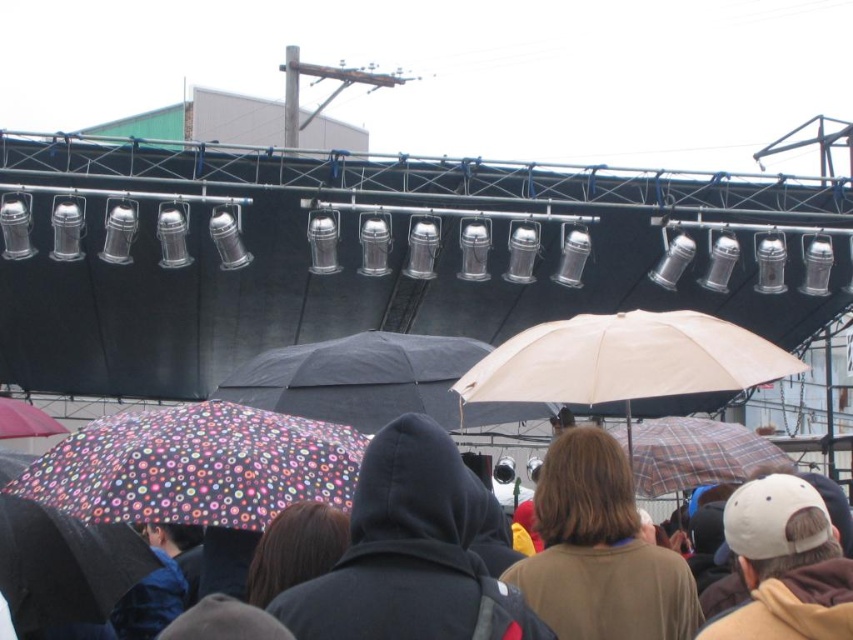
Question: Considering the real-world distances, which object is farthest from the beige matte umbrella at center?

Choices:
 (A) brown matte jacket at center
 (B) floral-patterned fabric umbrella at lower left
 (C) polka dot fabric umbrella at lower left

Answer: (B)

Question: Which object is closer to the camera taking this photo?

Choices:
 (A) beige matte umbrella at center
 (B) polka dot fabric umbrella at lower left
 (C) brown matte jacket at center

Answer: (B)

Question: Does printed fabric umbrella at center appear on the right side of brown matte jacket at center?

Choices:
 (A) no
 (B) yes

Answer: (A)

Question: Observing the image, what is the correct spatial positioning of beige matte umbrella at center in reference to floral-patterned fabric umbrella at lower left?

Choices:
 (A) right
 (B) left

Answer: (A)

Question: Estimate the real-world distances between objects in this image. Which object is farther from the black matte umbrella at center?

Choices:
 (A) plaid fabric umbrella at center
 (B) floral-patterned fabric umbrella at lower left
 (C) beige matte umbrella at center
 (D) polka dot fabric umbrella at lower left

Answer: (B)

Question: Is brown matte jacket at center wider than beige matte umbrella at center?

Choices:
 (A) yes
 (B) no

Answer: (B)